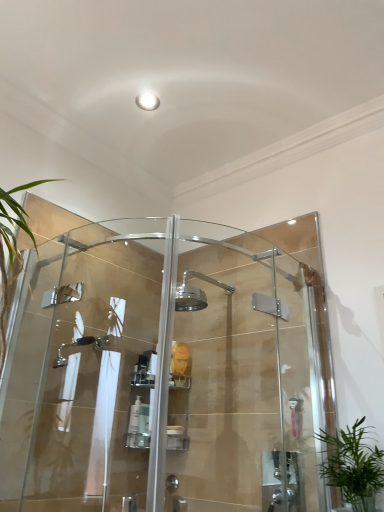
The image size is (384, 512). Describe the element at coordinates (248, 372) in the screenshot. I see `clear glass shower door at center, positioned as the 2th screen door in left-to-right order` at that location.

You are a GUI agent. You are given a task and a screenshot of the screen. Output one action in this format:
    pyautogui.click(x=<x>, y=<y>)
    Task: Click on the clear glass shower door at center, positioned as the 2th screen door in left-to-right order
    
    Given the screenshot: What is the action you would take?
    pyautogui.click(x=248, y=372)

Measure the distance between white plastic pump bottle at center, the 3th toiletry positioned from the right, and camera.

white plastic pump bottle at center, the 3th toiletry positioned from the right, and camera are 3.82 feet apart from each other.

This screenshot has width=384, height=512. I want to click on green leafy plant at lower right, so click(x=353, y=466).

You are a GUI agent. You are given a task and a screenshot of the screen. Output one action in this format:
    pyautogui.click(x=<x>, y=<y>)
    Task: Click on the clear glass shower door at center, the 1th screen door from the right
    The width and height of the screenshot is (384, 512).
    Given the screenshot: What is the action you would take?
    tap(248, 372)

Is the depth of white plastic soap dish at center, which appears as the 1th toiletry when viewed from the right, greater than that of clear glass shower door at center, which ranks as the 1th screen door in left-to-right order?

Yes, white plastic soap dish at center, which appears as the 1th toiletry when viewed from the right, is behind clear glass shower door at center, which ranks as the 1th screen door in left-to-right order.

Is point (177, 433) closer or farther from the camera than point (122, 383)?

Point (177, 433) is positioned closer to the camera compared to point (122, 383).

Can we say white plastic soap dish at center, the third toiletry when ordered from left to right, lies outside clear glass shower door at center, which ranks as the 1th screen door in left-to-right order?

Yes, white plastic soap dish at center, the third toiletry when ordered from left to right, is located beyond the bounds of clear glass shower door at center, which ranks as the 1th screen door in left-to-right order.

Considering the sizes of objects white plastic soap dish at center, the third toiletry when ordered from left to right, and clear glass shower door at center, which is the 2th screen door from right to left, in the image provided, who is smaller, white plastic soap dish at center, the third toiletry when ordered from left to right, or clear glass shower door at center, which is the 2th screen door from right to left,?

white plastic soap dish at center, the third toiletry when ordered from left to right, is smaller.

From the clear glass shower door at center, positioned as the 2th screen door in left-to-right order, count the 3rd toiletry to the left and point to it. Please provide its 2D coordinates.

[(136, 425)]

Does point (290, 423) come farther from viewer compared to point (134, 443)?

Yes, point (290, 423) is farther from viewer.

From the image's perspective, which is above, clear glass shower door at center, positioned as the 2th screen door in left-to-right order, or white plastic pump bottle at center, marked as the first toiletry in a left-to-right arrangement?

clear glass shower door at center, positioned as the 2th screen door in left-to-right order.

Is clear glass shower door at center, positioned as the 2th screen door in left-to-right order, far away from white plastic pump bottle at center, marked as the first toiletry in a left-to-right arrangement?

clear glass shower door at center, positioned as the 2th screen door in left-to-right order, is near white plastic pump bottle at center, marked as the first toiletry in a left-to-right arrangement, not far away.

Which point is more forward, (116, 303) or (362, 490)?

The point (362, 490) is closer to the camera.

Looking at this image, does clear glass shower door at center, which ranks as the 1th screen door in left-to-right order, have a greater width compared to green leafy plant at lower right?

No.

From the image's perspective, would you say clear glass shower door at center, which is the 2th screen door from right to left, is shown under green leafy plant at lower right?

Incorrect, from the image's perspective, clear glass shower door at center, which is the 2th screen door from right to left, is higher than green leafy plant at lower right.

Who is taller, white plastic soap dish at center, the third toiletry when ordered from left to right, or clear glass shower door at center, the 1th screen door from the right?

With more height is clear glass shower door at center, the 1th screen door from the right.

Is white plastic soap dish at center, which appears as the 1th toiletry when viewed from the right, next to clear glass shower door at center, positioned as the 2th screen door in left-to-right order?

No.

Is white plastic soap dish at center, which appears as the 1th toiletry when viewed from the right, not within clear glass shower door at center, the 1th screen door from the right?

Absolutely, white plastic soap dish at center, which appears as the 1th toiletry when viewed from the right, is external to clear glass shower door at center, the 1th screen door from the right.

Is white plastic soap dish at center, which appears as the 1th toiletry when viewed from the right, bigger or smaller than clear glass shower door at center, the 1th screen door from the right?

In the image, white plastic soap dish at center, which appears as the 1th toiletry when viewed from the right, appears to be smaller than clear glass shower door at center, the 1th screen door from the right.

Is clear glass shower door at center, which is the 2th screen door from right to left, to the right of clear glass shower door at center, positioned as the 2th screen door in left-to-right order, from the viewer's perspective?

In fact, clear glass shower door at center, which is the 2th screen door from right to left, is to the left of clear glass shower door at center, positioned as the 2th screen door in left-to-right order.

Which is more distant, (38, 360) or (188, 308)?

Positioned behind is point (188, 308).

Is clear glass shower door at center, the 1th screen door from the right, at the back of clear glass shower door at center, which ranks as the 1th screen door in left-to-right order?

Yes, clear glass shower door at center, the 1th screen door from the right, is at the back of clear glass shower door at center, which ranks as the 1th screen door in left-to-right order.

What's the angular difference between clear glass shower door at center, which ranks as the 1th screen door in left-to-right order, and clear glass shower door at center, positioned as the 2th screen door in left-to-right order,'s facing directions?

90 degrees.

Is white plastic pump bottle at center, marked as the first toiletry in a left-to-right arrangement, placed right next to clear glass shower door at center, positioned as the 2th screen door in left-to-right order?

No, white plastic pump bottle at center, marked as the first toiletry in a left-to-right arrangement, is not next to clear glass shower door at center, positioned as the 2th screen door in left-to-right order.

Between white plastic pump bottle at center, the 3th toiletry positioned from the right, and clear glass shower door at center, the 1th screen door from the right, which one has less height?

Standing shorter between the two is white plastic pump bottle at center, the 3th toiletry positioned from the right.

Is white plastic pump bottle at center, marked as the first toiletry in a left-to-right arrangement, positioned beyond the bounds of clear glass shower door at center, positioned as the 2th screen door in left-to-right order?

That's correct, white plastic pump bottle at center, marked as the first toiletry in a left-to-right arrangement, is outside of clear glass shower door at center, positioned as the 2th screen door in left-to-right order.

Between clear plastic bottle at center, which is the 2th toiletry from left to right, and clear glass shower door at center, which ranks as the 1th screen door in left-to-right order, which one has more height?

With more height is clear glass shower door at center, which ranks as the 1th screen door in left-to-right order.

Is clear plastic bottle at center, acting as the 2th toiletry starting from the right, next to clear glass shower door at center, which is the 2th screen door from right to left?

No, clear plastic bottle at center, acting as the 2th toiletry starting from the right, is not in contact with clear glass shower door at center, which is the 2th screen door from right to left.

Is the position of clear plastic bottle at center, acting as the 2th toiletry starting from the right, more distant than that of clear glass shower door at center, which ranks as the 1th screen door in left-to-right order?

Yes, clear plastic bottle at center, acting as the 2th toiletry starting from the right, is further from the viewer.

Considering the sizes of clear plastic bottle at center, acting as the 2th toiletry starting from the right, and clear glass shower door at center, which ranks as the 1th screen door in left-to-right order, in the image, is clear plastic bottle at center, acting as the 2th toiletry starting from the right, wider or thinner than clear glass shower door at center, which ranks as the 1th screen door in left-to-right order,?

In the image, clear plastic bottle at center, acting as the 2th toiletry starting from the right, appears to be more narrow than clear glass shower door at center, which ranks as the 1th screen door in left-to-right order.

From the image's perspective, count 3rd toiletrys downward from the clear glass shower door at center, which is the 2th screen door from right to left, and point to it. Please provide its 2D coordinates.

[(176, 438)]

Identify the location of screen door that is on the right side of white plastic pump bottle at center, marked as the first toiletry in a left-to-right arrangement. This screenshot has height=512, width=384. (248, 372).

From the picture: Which object lies further to the anchor point white plastic pump bottle at center, the 3th toiletry positioned from the right, clear glass shower door at center, positioned as the 2th screen door in left-to-right order, or clear plastic bottle at center, acting as the 2th toiletry starting from the right?

clear glass shower door at center, positioned as the 2th screen door in left-to-right order, is positioned further to the anchor white plastic pump bottle at center, the 3th toiletry positioned from the right.

From the image, which object appears to be farther from white plastic pump bottle at center, marked as the first toiletry in a left-to-right arrangement, green leafy plant at lower right or clear plastic bottle at center, which is the 2th toiletry from left to right?

green leafy plant at lower right is positioned further to the anchor white plastic pump bottle at center, marked as the first toiletry in a left-to-right arrangement.

When comparing their distances from clear plastic bottle at center, which is the 2th toiletry from left to right, does green leafy plant at lower right or white plastic soap dish at center, which appears as the 1th toiletry when viewed from the right, seem further?

green leafy plant at lower right.

Which object lies nearer to the anchor point clear glass shower door at center, the 1th screen door from the right, white plastic soap dish at center, the third toiletry when ordered from left to right, or white plastic pump bottle at center, the 3th toiletry positioned from the right?

white plastic soap dish at center, the third toiletry when ordered from left to right.

When comparing their distances from clear plastic bottle at center, acting as the 2th toiletry starting from the right, does white plastic pump bottle at center, marked as the first toiletry in a left-to-right arrangement, or clear glass shower door at center, which is the 2th screen door from right to left, seem closer?

white plastic pump bottle at center, marked as the first toiletry in a left-to-right arrangement, lies closer to clear plastic bottle at center, acting as the 2th toiletry starting from the right, than the other object.

When comparing their distances from green leafy plant at lower right, does clear plastic bottle at center, acting as the 2th toiletry starting from the right, or clear glass shower door at center, which ranks as the 1th screen door in left-to-right order, seem closer?

clear plastic bottle at center, acting as the 2th toiletry starting from the right, lies closer to green leafy plant at lower right than the other object.

Estimate the real-world distances between objects in this image. Which object is further from white plastic pump bottle at center, the 3th toiletry positioned from the right, clear glass shower door at center, positioned as the 2th screen door in left-to-right order, or white plastic soap dish at center, which appears as the 1th toiletry when viewed from the right?

The object further to white plastic pump bottle at center, the 3th toiletry positioned from the right, is clear glass shower door at center, positioned as the 2th screen door in left-to-right order.

Based on their spatial positions, is white plastic pump bottle at center, marked as the first toiletry in a left-to-right arrangement, or green leafy plant at lower right further from clear glass shower door at center, the 1th screen door from the right?

white plastic pump bottle at center, marked as the first toiletry in a left-to-right arrangement, is positioned further to the anchor clear glass shower door at center, the 1th screen door from the right.

The image size is (384, 512). I want to click on toiletry situated between white plastic pump bottle at center, marked as the first toiletry in a left-to-right arrangement, and white plastic soap dish at center, the third toiletry when ordered from left to right, from left to right, so click(x=143, y=426).

Where is `houseplant between clear glass shower door at center, the 1th screen door from the right, and white plastic pump bottle at center, the 3th toiletry positioned from the right, from front to back`? The height and width of the screenshot is (512, 384). houseplant between clear glass shower door at center, the 1th screen door from the right, and white plastic pump bottle at center, the 3th toiletry positioned from the right, from front to back is located at coordinates (353, 466).

Image resolution: width=384 pixels, height=512 pixels. I want to click on houseplant between clear glass shower door at center, the 1th screen door from the right, and clear plastic bottle at center, acting as the 2th toiletry starting from the right, from front to back, so click(353, 466).

Locate an element on the screen. Image resolution: width=384 pixels, height=512 pixels. screen door between clear glass shower door at center, which is the 2th screen door from right to left, and white plastic soap dish at center, the third toiletry when ordered from left to right, from front to back is located at coordinates (248, 372).